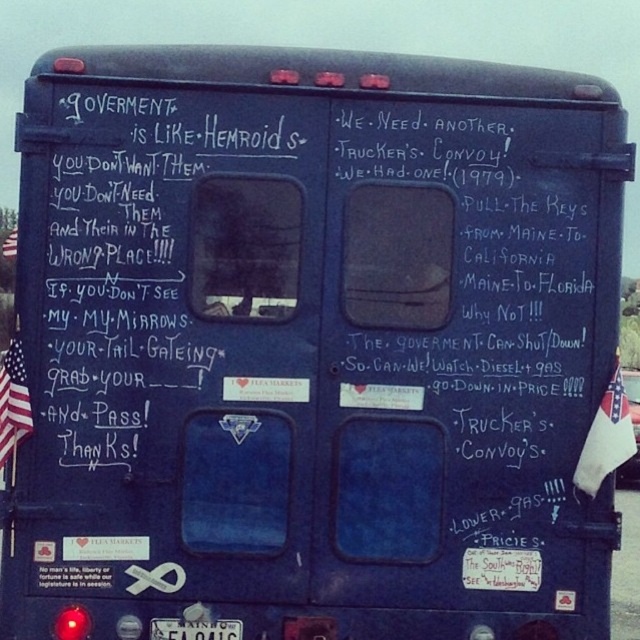
You are a photographer taking a picture of the truck tailgate with both the american flag fabric at right and the american flag at left. Which flag should you focus on first to ensure it appears larger in the photo?

The american flag fabric at right is closer to the viewer than the american flag at left, so focusing on it first will make it appear larger in the photo.